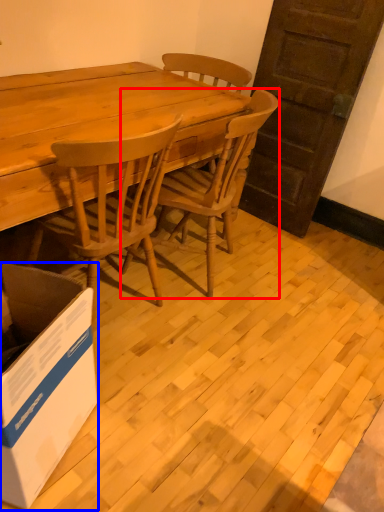
Question: Which object appears farthest to the camera in this image, chair (highlighted by a red box) or box (highlighted by a blue box)?

Choices:
 (A) chair
 (B) box

Answer: (A)